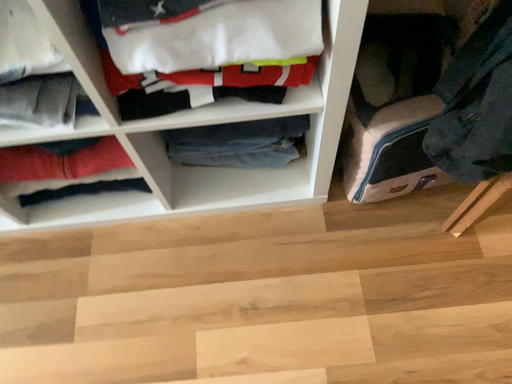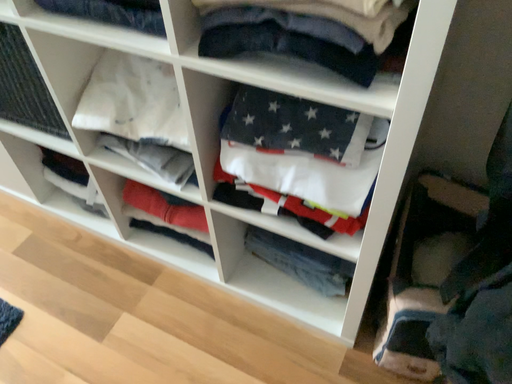
Question: Which way did the camera rotate in the video?

Choices:
 (A) rotated downward
 (B) rotated upward

Answer: (B)